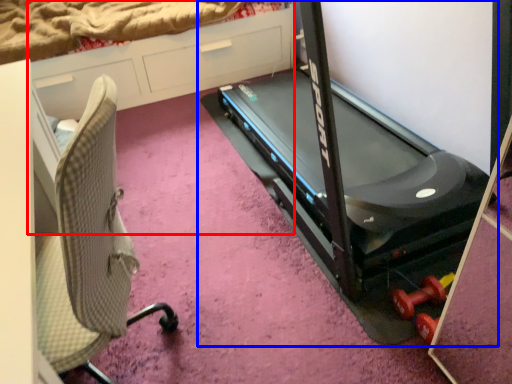
Question: Which of the following is the farthest to the observer, dresser (highlighted by a red box) or treadmill (highlighted by a blue box)?

Choices:
 (A) dresser
 (B) treadmill

Answer: (A)